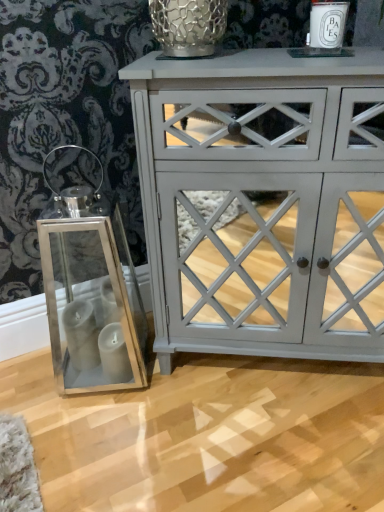
You are a GUI agent. You are given a task and a screenshot of the screen. Output one action in this format:
    pyautogui.click(x=<x>, y=<y>)
    Task: Click on the vacant area that is in front of white ceramic candle at upper right
    
    Given the screenshot: What is the action you would take?
    pyautogui.click(x=331, y=65)